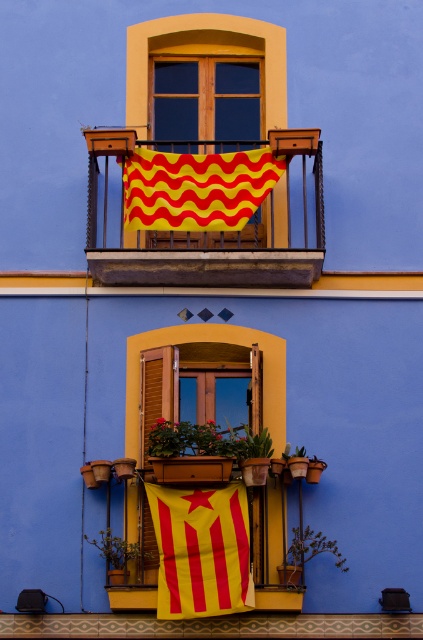
You are standing in front of the building and want to place a new decorative item on the wooden at left and wooden at center. Which one would you need to move first to access the other?

You would need to move the wooden at left first because the wooden at center is behind it, so moving the one in front allows access to the one behind.

You are an architect assessing the building facade. You need to install a new decorative element between the matte wood window at upper center and the wooden at center. Based on their widths, which object should the element be placed closer to?

The matte wood window at upper center might be wider than wooden at center, so the decorative element should be placed closer to the matte wood window at upper center to ensure proper alignment and balance.